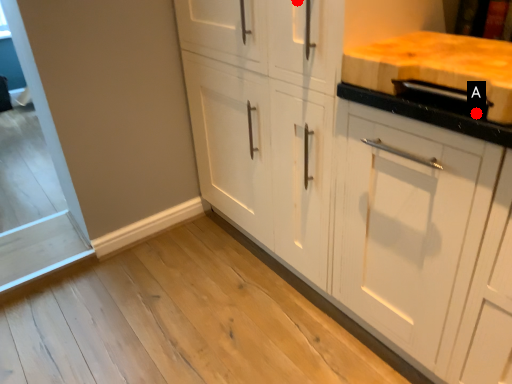
Question: Two points are circled on the image, labeled by A and B beside each circle. Among these points, which one is nearest to the camera?

Choices:
 (A) A is closer
 (B) B is closer

Answer: (A)